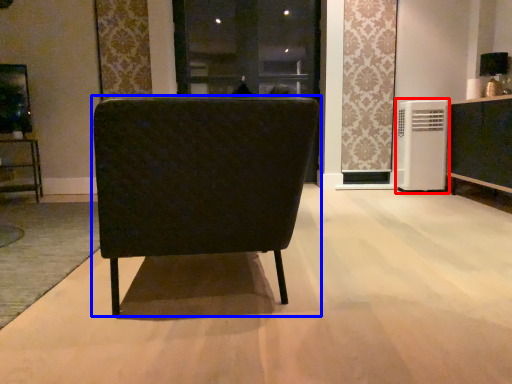
Question: Which point is further to the camera, air conditioner (highlighted by a red box) or chair (highlighted by a blue box)?

Choices:
 (A) air conditioner
 (B) chair

Answer: (A)